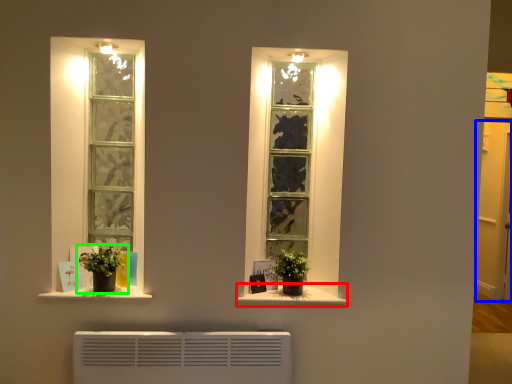
Question: Based on their relative distances, which object is nearer to window sill (highlighted by a red box)? Choose from glass door (highlighted by a blue box) and houseplant (highlighted by a green box).

Choices:
 (A) glass door
 (B) houseplant

Answer: (B)